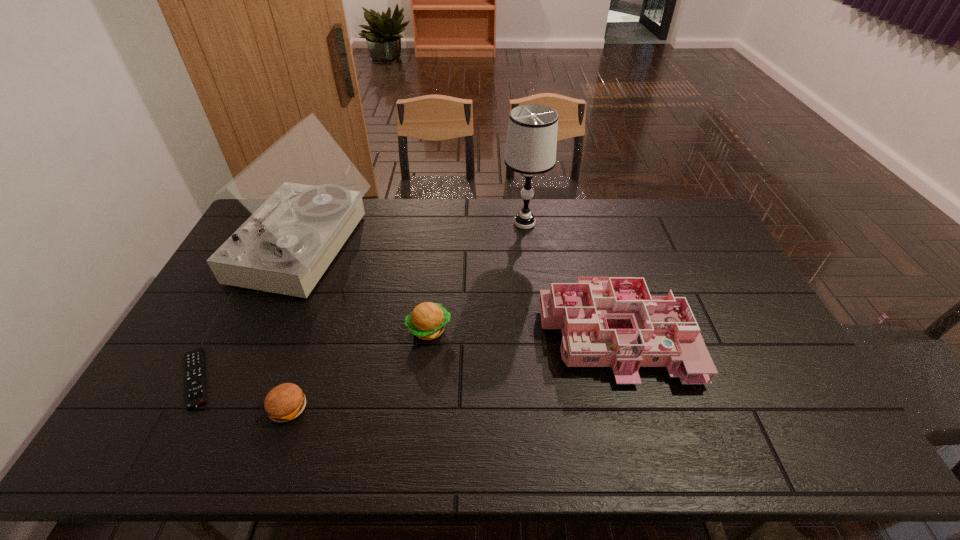
The image size is (960, 540). What are the coordinates of `vacant space in between the farther hamburger and the table lamp` in the screenshot? It's located at (477, 276).

Find the location of a particular element. This screenshot has width=960, height=540. empty location between the remote control and the dollhouse is located at coordinates (404, 355).

Image resolution: width=960 pixels, height=540 pixels. I want to click on free space between the table lamp and the third tallest object, so 569,278.

This screenshot has width=960, height=540. I want to click on blank region between the third object from right to left and the shortest object, so click(312, 354).

The width and height of the screenshot is (960, 540). Find the location of `vacant space that is in between the record player and the table lamp`. vacant space that is in between the record player and the table lamp is located at coordinates (415, 236).

Locate an element on the screen. the third closest object to the third object from right to left is located at coordinates (613, 322).

The height and width of the screenshot is (540, 960). Identify the location of object that ranks as the third closest to the shorter hamburger. (305, 195).

The image size is (960, 540). I want to click on vacant region that satisfies the following two spatial constraints: 1. on the back side of the right hamburger; 2. on the right side of the table lamp, so click(x=441, y=223).

You are a GUI agent. You are given a task and a screenshot of the screen. Output one action in this format:
    pyautogui.click(x=<x>, y=<y>)
    Task: Click on the free space that satisfies the following two spatial constraints: 1. on the back side of the record player; 2. on the right side of the table lamp
    Image resolution: width=960 pixels, height=540 pixels.
    Given the screenshot: What is the action you would take?
    pyautogui.click(x=317, y=223)